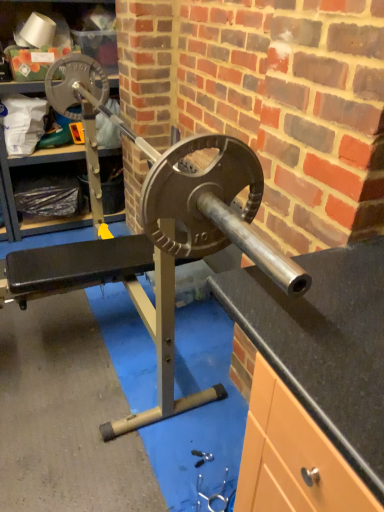
The image size is (384, 512). In order to click on matte black weight at left in this screenshot , I will do `click(12, 190)`.

The height and width of the screenshot is (512, 384). Describe the element at coordinates (12, 190) in the screenshot. I see `matte black weight at left` at that location.

Describe the element at coordinates (202, 457) in the screenshot. I see `metallic silver tool at lower center` at that location.

The image size is (384, 512). I want to click on metallic silver tool at lower center, so [202, 457].

At what (x,y) coordinates should I click in order to perform the action: click on matte black weight at left. Please return your answer as a coordinate pair (x, y). Looking at the image, I should click on (12, 190).

Is metallic silver tool at lower center at the right side of matte black weight at left?

Yes, metallic silver tool at lower center is to the right of matte black weight at left.

Considering the positions of objects metallic silver tool at lower center and matte black weight at left in the image provided, who is in front, metallic silver tool at lower center or matte black weight at left?

metallic silver tool at lower center.

Is point (206, 458) in front of point (13, 16)?

Yes.

From the image's perspective, would you say metallic silver tool at lower center is shown under matte black weight at left?

Yes.

From a real-world perspective, which object rests below the other?

metallic silver tool at lower center.

Can you confirm if metallic silver tool at lower center is thinner than matte black weight at left?

Yes.

Consider the image. Does metallic silver tool at lower center have a lesser height compared to matte black weight at left?

Yes, metallic silver tool at lower center is shorter than matte black weight at left.

Does metallic silver tool at lower center have a larger size compared to matte black weight at left?

Incorrect, metallic silver tool at lower center is not larger than matte black weight at left.

Is metallic silver tool at lower center positioned beyond the bounds of matte black weight at left?

That's correct, metallic silver tool at lower center is outside of matte black weight at left.

Is metallic silver tool at lower center not close to matte black weight at left?

Yes, metallic silver tool at lower center is far from matte black weight at left.

Is metallic silver tool at lower center turned away from matte black weight at left?

metallic silver tool at lower center is not turned away from matte black weight at left.

How different are the orientations of metallic silver tool at lower center and matte black weight at left in degrees?

92.2 degrees.

Measure the distance from metallic silver tool at lower center to matte black weight at left.

The distance of metallic silver tool at lower center from matte black weight at left is 6.42 feet.

Locate an element on the screen. This screenshot has height=512, width=384. tool below the matte black weight at left (from the image's perspective) is located at coordinates (202, 457).

Can you confirm if matte black weight at left is positioned to the right of metallic silver tool at lower center?

In fact, matte black weight at left is to the left of metallic silver tool at lower center.

Is matte black weight at left behind metallic silver tool at lower center?

Yes, it is behind metallic silver tool at lower center.

Considering the positions of points (0, 173) and (204, 452), is point (0, 173) closer to camera compared to point (204, 452)?

No.

From the image's perspective, which is above, matte black weight at left or metallic silver tool at lower center?

matte black weight at left.

From a real-world perspective, between matte black weight at left and metallic silver tool at lower center, who is vertically lower?

metallic silver tool at lower center, from a real-world perspective.

Does matte black weight at left have a lesser width compared to metallic silver tool at lower center?

No.

Considering the sizes of objects matte black weight at left and metallic silver tool at lower center in the image provided, who is shorter, matte black weight at left or metallic silver tool at lower center?

Standing shorter between the two is metallic silver tool at lower center.

Can you confirm if matte black weight at left is smaller than metallic silver tool at lower center?

Incorrect, matte black weight at left is not smaller in size than metallic silver tool at lower center.

Is matte black weight at left inside or outside of metallic silver tool at lower center?

matte black weight at left is not inside metallic silver tool at lower center, it's outside.

Is matte black weight at left placed right next to metallic silver tool at lower center?

matte black weight at left and metallic silver tool at lower center are clearly separated.

Is matte black weight at left oriented away from metallic silver tool at lower center?

No, matte black weight at left is not facing the opposite direction of metallic silver tool at lower center.

How different are the orientations of matte black weight at left and metallic silver tool at lower center in degrees?

The angular difference between matte black weight at left and metallic silver tool at lower center is 92.2 degrees.

Where is `cabinet that appears above the metallic silver tool at lower center (from a real-world perspective)`? cabinet that appears above the metallic silver tool at lower center (from a real-world perspective) is located at coordinates (12, 190).

In the image, there is a matte black weight at left. At what (x,y) coordinates should I click in order to perform the action: click on tool below it (from a real-world perspective). Please return your answer as a coordinate pair (x, y). The image size is (384, 512). Looking at the image, I should click on (202, 457).

The height and width of the screenshot is (512, 384). In order to click on tool that appears in front of the matte black weight at left in this screenshot , I will do `click(202, 457)`.